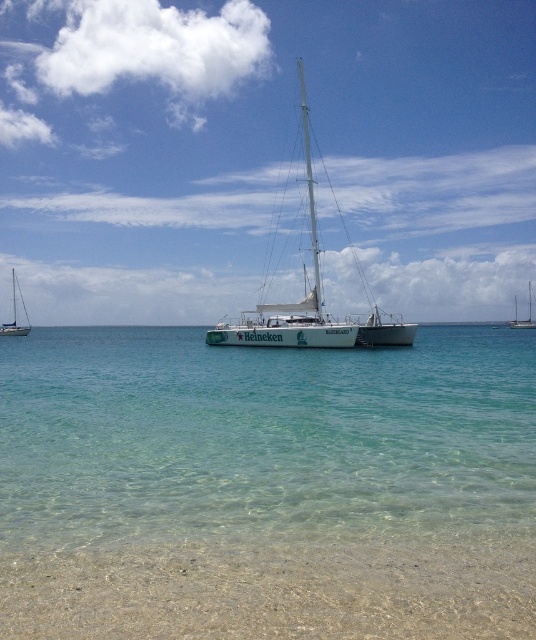
You are a photographer planning to take a photo of the clear sand at lower center and the white glossy sailboat at left. Based on their positions, which object will appear larger in the photo?

The white glossy sailboat at left will appear larger in the photo because it is taller than the clear sand at lower center.

You are standing on the beach looking at the scene. Which object is closer to you, the clear sand at lower center or the white glossy sailboat at center?

The clear sand at lower center is closer to the viewer than the white glossy sailboat at center.

You are a photographer planning to take a photo of the white glossy sailboat at center. You want to ensure that the clear sand at lower center is visible in the reflection of the boat. Is the positioning of the sand and boat suitable for this?

The clear sand at lower center is positioned under the white glossy sailboat at center, so yes, the positioning is suitable because the sand is directly beneath the boat, making it likely to be reflected in its surface.